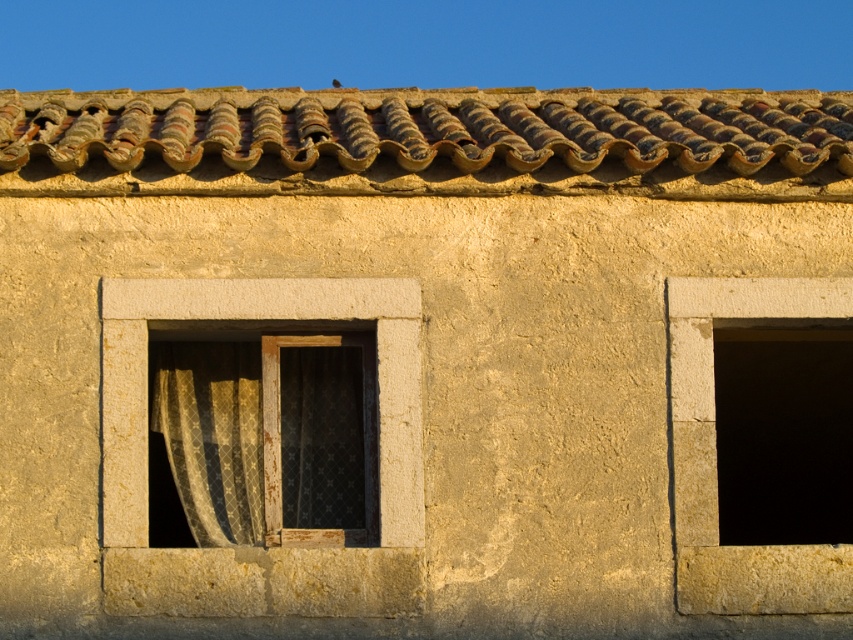
You are standing 10 meters away from a building facade. There is a point at coordinates point (100, 134). Can you reach that point with a 3 meter long pole?

The distance of point (100, 134) from viewer is 12.44 meters, so no, the pole is too short to reach it.

You are an architect assessing the building facade. You need to determine if the rusty clay tiles at top can cover the matte stone window at center left completely. Based on their sizes, what do you conclude?

The rusty clay tiles at top have a larger width than the matte stone window at center left, so they could potentially cover it completely if positioned appropriately.